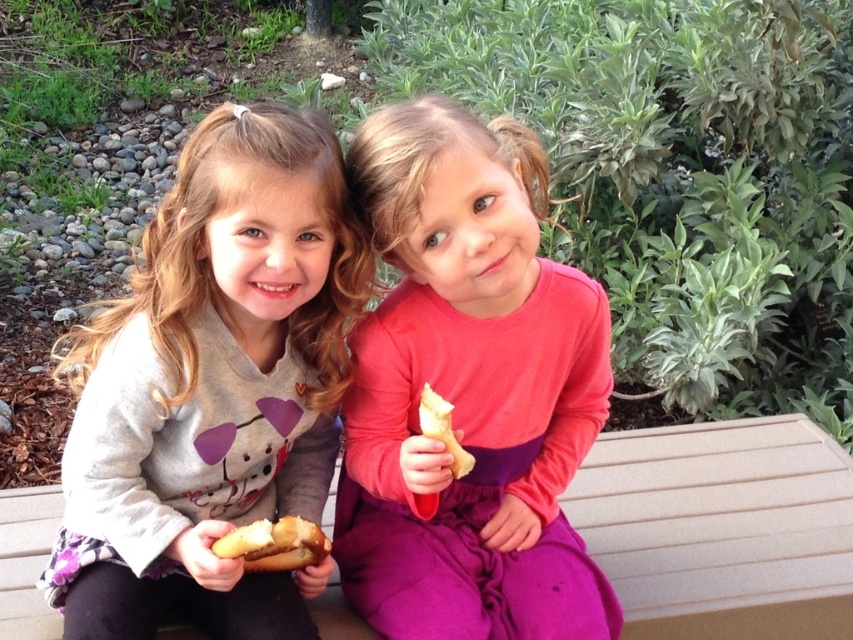
Can you confirm if bread-like at center is positioned above yellowish bread at center?

No, bread-like at center is not above yellowish bread at center.

Is point (294, 538) less distant than point (459, 458)?

That is False.

What are the coordinates of `bread-like at center` in the screenshot? It's located at (274, 545).

Is matte gray sweater at center taller than yellowish bread at center?

Yes.

Does matte gray sweater at center have a lesser height compared to yellowish bread at center?

No, matte gray sweater at center is not shorter than yellowish bread at center.

Is point (225, 580) more distant than point (450, 424)?

No, it is not.

Identify the location of matte gray sweater at center. The height and width of the screenshot is (640, 853). (213, 387).

Does matte pink dress at center have a greater height compared to yellowish bread at center?

Indeed, matte pink dress at center has a greater height compared to yellowish bread at center.

Which of these two, matte pink dress at center or yellowish bread at center, stands shorter?

Standing shorter between the two is yellowish bread at center.

Is point (389, 234) closer to camera compared to point (471, 456)?

Yes, point (389, 234) is in front of point (471, 456).

Find the location of a particular element. This screenshot has height=640, width=853. matte pink dress at center is located at coordinates (468, 392).